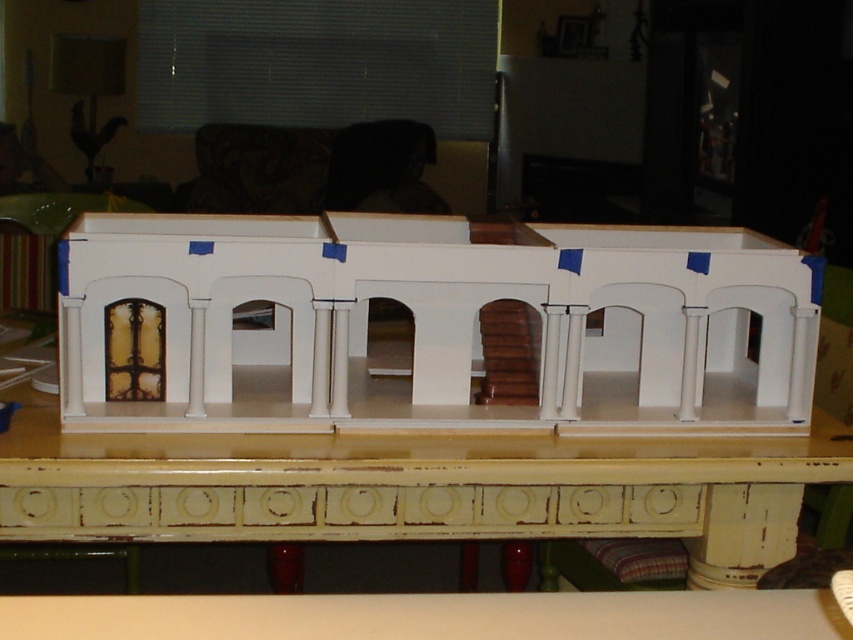
You are a visitor in the living room where the white matte building at center and the white distressed wood table at center are displayed. You want to determine which object is taller. Based on the scene, can you figure out which one is taller?

The white matte building at center is taller than the white distressed wood table at center.

You are arranging a display in a living room and want to place a small potted plant between the white matte building at center and the white distressed wood table at center. Based on their positions, which object should the plant be closer to?

The white distressed wood table at center is behind the white matte building at center, so the plant should be placed closer to the white matte building at center to be between them.